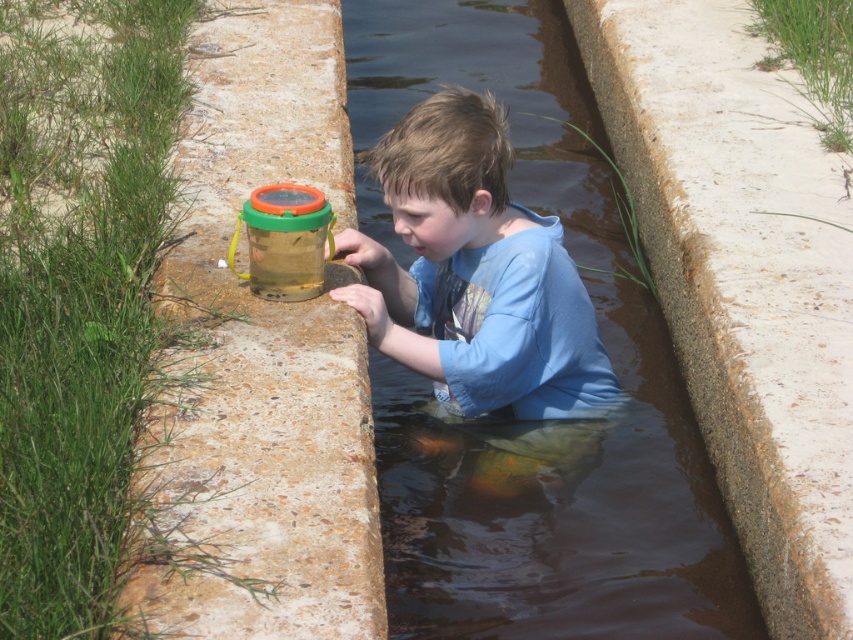
Is rusty concrete ledge at left wider than blue cotton shirt at center?

Yes.

Which is below, rusty concrete ledge at left or blue cotton shirt at center?

blue cotton shirt at center

Identify the location of rusty concrete ledge at left. This screenshot has height=640, width=853. (257, 364).

Identify the location of rusty concrete ledge at left. click(257, 364).

Can you confirm if rusty concrete at center is positioned below blue cotton shirt at center?

Yes.

Does rusty concrete at center appear on the left side of blue cotton shirt at center?

In fact, rusty concrete at center is to the right of blue cotton shirt at center.

You are a GUI agent. You are given a task and a screenshot of the screen. Output one action in this format:
    pyautogui.click(x=<x>, y=<y>)
    Task: Click on the rusty concrete at center
    This screenshot has width=853, height=640.
    Given the screenshot: What is the action you would take?
    540,422

Between rusty concrete at center and rusty concrete ledge at left, which one is positioned higher?

rusty concrete ledge at left is above.

Does rusty concrete at center appear under rusty concrete ledge at left?

Yes.

Who is more distant from viewer, [471,554] or [248,381]?

Point [471,554]

You are a GUI agent. You are given a task and a screenshot of the screen. Output one action in this format:
    pyautogui.click(x=<x>, y=<y>)
    Task: Click on the rusty concrete at center
    
    Given the screenshot: What is the action you would take?
    pos(540,422)